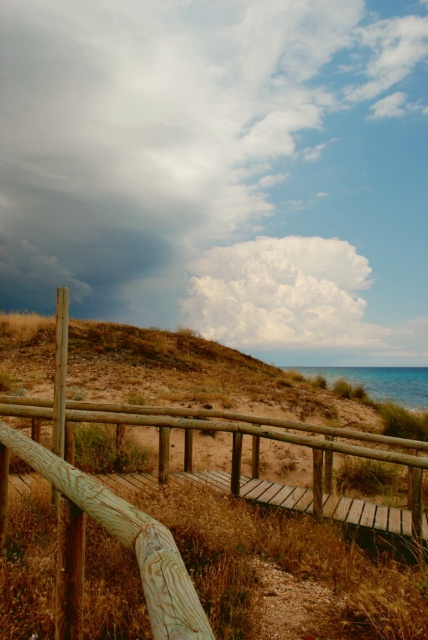
Which of these two, wooden at center or white fluffy cloud at upper center, stands taller?

white fluffy cloud at upper center is taller.

Is the position of wooden at center less distant than that of white fluffy cloud at upper center?

Yes.

Measure the distance between wooden at center and camera.

wooden at center and camera are 5.59 meters apart from each other.

This screenshot has width=428, height=640. Identify the location of wooden at center. (166, 481).